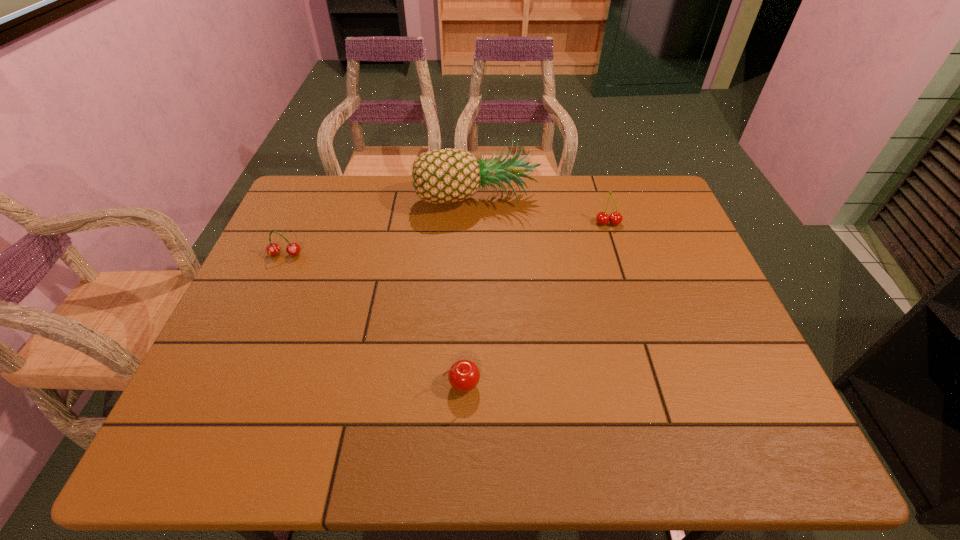
Locate an element on the screen. The width and height of the screenshot is (960, 540). empty location between the second nearest cherry and the rightmost object is located at coordinates (446, 239).

You are a GUI agent. You are given a task and a screenshot of the screen. Output one action in this format:
    pyautogui.click(x=<x>, y=<y>)
    Task: Click on the vacant space that's between the rightmost cherry and the nearest object
    Image resolution: width=960 pixels, height=540 pixels.
    Given the screenshot: What is the action you would take?
    pyautogui.click(x=536, y=304)

The image size is (960, 540). What are the coordinates of `empty space between the tallest object and the rightmost object` in the screenshot? It's located at (541, 210).

Where is `vacant area that lies between the rightmost cherry and the nearest cherry`? Image resolution: width=960 pixels, height=540 pixels. vacant area that lies between the rightmost cherry and the nearest cherry is located at coordinates (536, 304).

Identify the location of free area in between the nearest object and the leftmost cherry. (374, 320).

Identify the location of vacant space that's between the nearest object and the tallest object. The height and width of the screenshot is (540, 960). (469, 291).

Where is `vacant space that is in between the nearest object and the leftmost cherry`? The height and width of the screenshot is (540, 960). vacant space that is in between the nearest object and the leftmost cherry is located at coordinates (374, 320).

The height and width of the screenshot is (540, 960). What are the coordinates of `unoccupied position between the second farthest cherry and the rightmost object` in the screenshot? It's located at (446, 239).

In order to click on free area in between the rightmost object and the nearest cherry in this screenshot , I will do `click(536, 304)`.

Locate which object is the second closest to the pineapple. Please provide its 2D coordinates. Your answer should be formatted as a tuple, i.e. [(x, y)], where the tuple contains the x and y coordinates of a point satisfying the conditions above.

[(272, 249)]